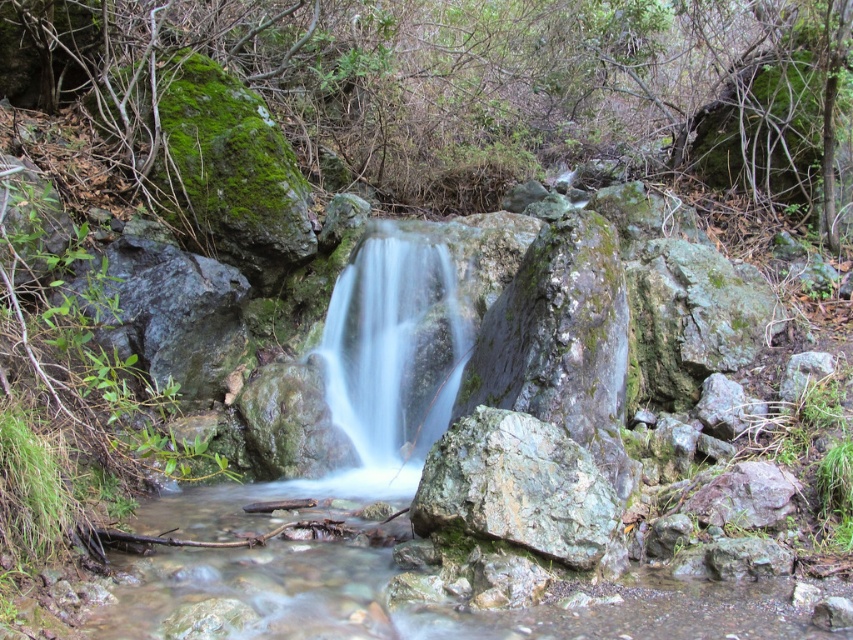
Does clear water at center have a lesser width compared to gray rough rock at center?

No, clear water at center is not thinner than gray rough rock at center.

Does clear water at center appear under gray rough rock at center?

Answer: Actually, clear water at center is above gray rough rock at center.

Between point (367, 257) and point (439, 460), which one is positioned in front?

Point (439, 460) is in front.

Find the location of a particular element. The image size is (853, 640). clear water at center is located at coordinates [393, 340].